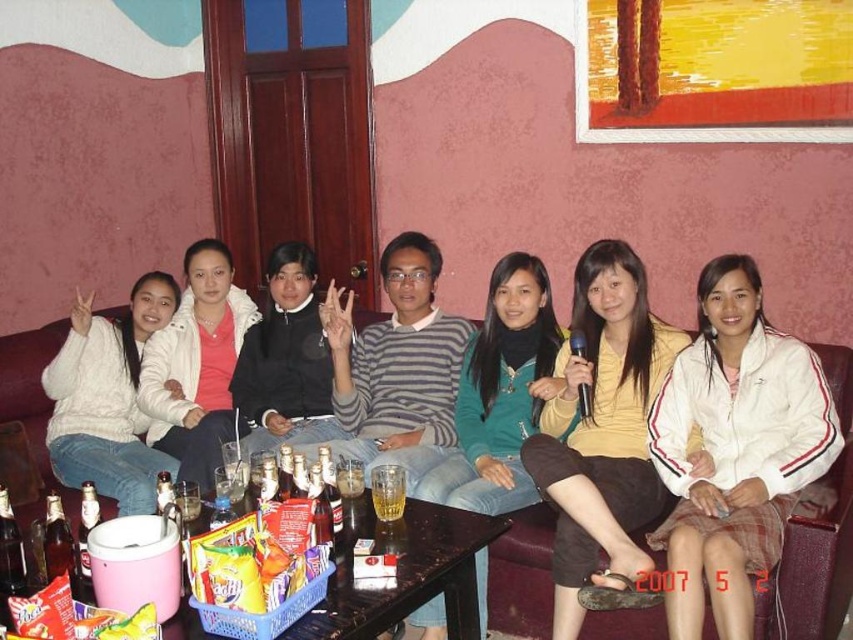
Question: Does white fabric jacket at center come behind pink fabric shirt at center?

Choices:
 (A) yes
 (B) no

Answer: (B)

Question: Can you confirm if pink fabric shirt at center is wider than black matte jacket at center?

Choices:
 (A) no
 (B) yes

Answer: (A)

Question: Which point appears farthest from the camera in this image?

Choices:
 (A) (618, 561)
 (B) (503, 477)
 (C) (717, 288)
 (D) (840, 596)

Answer: (B)

Question: Which point appears farthest from the camera in this image?

Choices:
 (A) (61, 408)
 (B) (631, 449)

Answer: (A)

Question: Among these points, which one is farthest from the camera?

Choices:
 (A) (251, 310)
 (B) (132, 413)

Answer: (A)

Question: Can you confirm if white fabric jacket at center is bigger than pink fabric shirt at center?

Choices:
 (A) no
 (B) yes

Answer: (B)